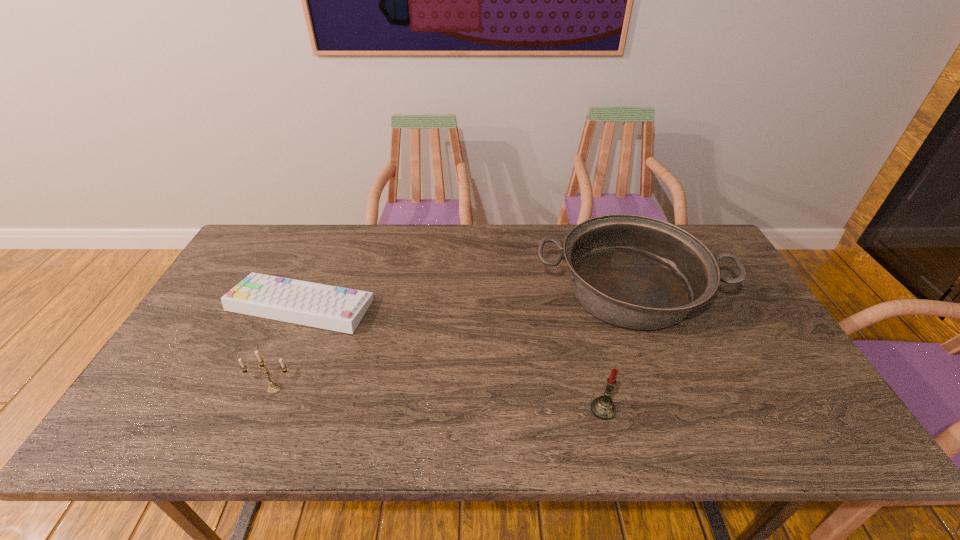
You are a GUI agent. You are given a task and a screenshot of the screen. Output one action in this format:
    pyautogui.click(x=<x>, y=<y>)
    Task: Click on the object positioned at the far edge
    This screenshot has width=960, height=540.
    Given the screenshot: What is the action you would take?
    pyautogui.click(x=637, y=272)

Identify the location of object present at the near edge. Image resolution: width=960 pixels, height=540 pixels. (602, 407).

Image resolution: width=960 pixels, height=540 pixels. I want to click on object that is at the left edge, so click(317, 305).

I want to click on object that is positioned at the right edge, so click(x=637, y=272).

Locate an element on the screen. object that is at the far right corner is located at coordinates (637, 272).

This screenshot has height=540, width=960. Find the location of `free space at the far edge`. free space at the far edge is located at coordinates (410, 244).

This screenshot has height=540, width=960. I want to click on vacant space at the near edge of the desktop, so click(312, 418).

This screenshot has height=540, width=960. In the image, there is a desktop. Find the location of `free space at the left edge`. free space at the left edge is located at coordinates (210, 372).

I want to click on free region at the right edge of the desktop, so click(x=717, y=289).

This screenshot has height=540, width=960. I want to click on vacant space at the far left corner of the desktop, so click(x=232, y=266).